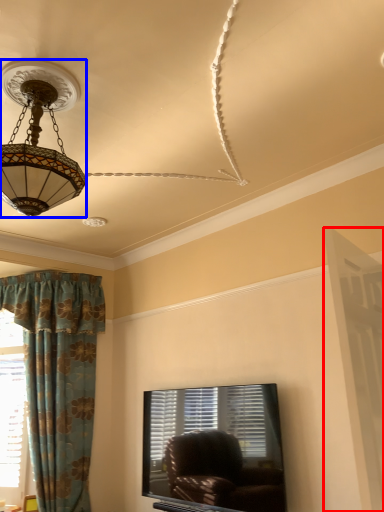
Question: Which of the following is the closest to the observer, screen door (highlighted by a red box) or lamp (highlighted by a blue box)?

Choices:
 (A) screen door
 (B) lamp

Answer: (A)